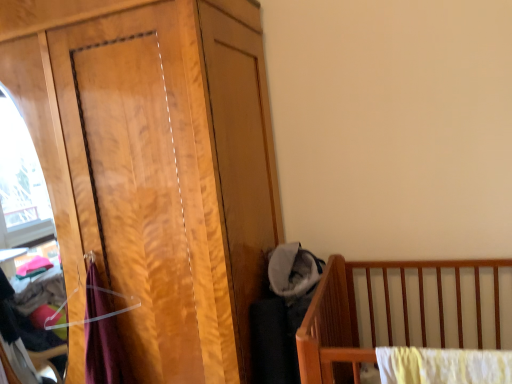
Question: From the image's perspective, is wooden wardrobe at left located beneath soft gray fabric at center?

Choices:
 (A) no
 (B) yes

Answer: (A)

Question: Is wooden wardrobe at left not close to soft gray fabric at center?

Choices:
 (A) yes
 (B) no

Answer: (B)

Question: Is wooden wardrobe at left taller than soft gray fabric at center?

Choices:
 (A) no
 (B) yes

Answer: (B)

Question: Does wooden wardrobe at left have a lesser height compared to soft gray fabric at center?

Choices:
 (A) yes
 (B) no

Answer: (B)

Question: Is the depth of wooden wardrobe at left greater than that of soft gray fabric at center?

Choices:
 (A) yes
 (B) no

Answer: (B)

Question: From a real-world perspective, is wooden wardrobe at left positioned under soft gray fabric at center based on gravity?

Choices:
 (A) yes
 (B) no

Answer: (B)

Question: Is soft gray fabric at center positioned behind wooden wardrobe at left?

Choices:
 (A) no
 (B) yes

Answer: (B)

Question: Can we say soft gray fabric at center lies outside wooden wardrobe at left?

Choices:
 (A) yes
 (B) no

Answer: (A)

Question: Could you tell me if soft gray fabric at center is turned towards wooden wardrobe at left?

Choices:
 (A) yes
 (B) no

Answer: (B)

Question: Is soft gray fabric at center turned away from wooden wardrobe at left?

Choices:
 (A) yes
 (B) no

Answer: (B)

Question: Is soft gray fabric at center thinner than wooden wardrobe at left?

Choices:
 (A) no
 (B) yes

Answer: (B)

Question: Does soft gray fabric at center contain wooden wardrobe at left?

Choices:
 (A) no
 (B) yes

Answer: (A)

Question: Is point (289, 289) positioned closer to the camera than point (47, 125)?

Choices:
 (A) farther
 (B) closer

Answer: (A)